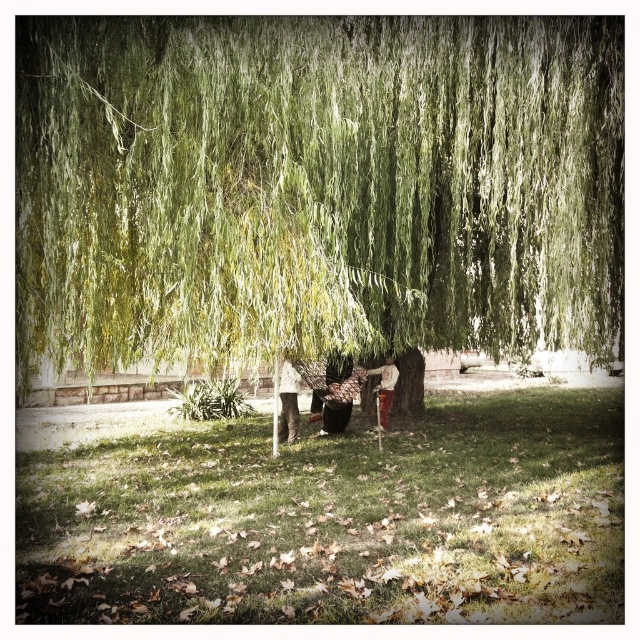
Does green leafy willow at center appear on the right side of green grass at lower center?

Yes, green leafy willow at center is to the right of green grass at lower center.

Between green leafy willow at center and green grass at lower center, which one has more height?

green leafy willow at center

Which is behind, point (42, 257) or point (225, 608)?

Point (42, 257)

Locate an element on the screen. Image resolution: width=640 pixels, height=640 pixels. green leafy willow at center is located at coordinates (316, 186).